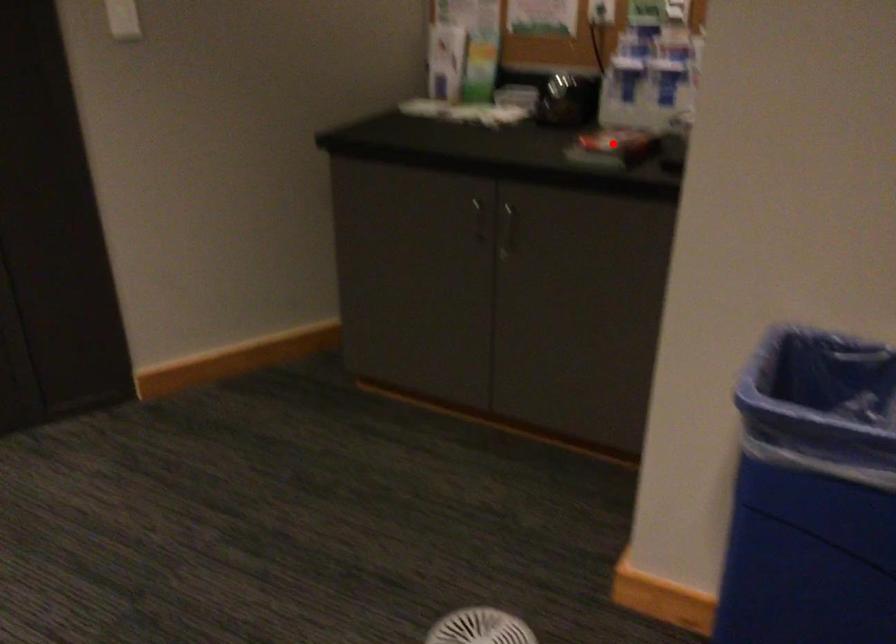
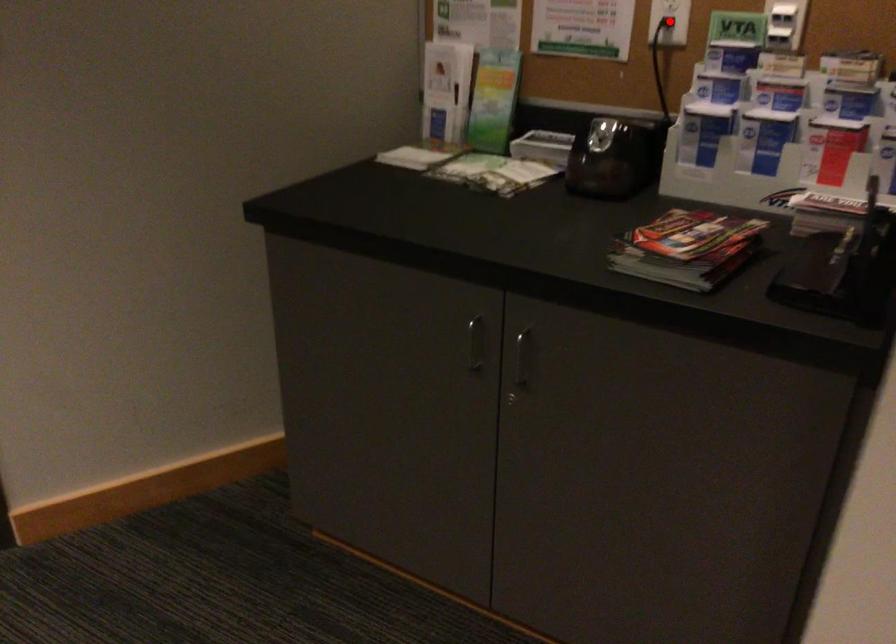
I am providing you with two images of the same scene from different viewpoints. A red point is marked on the first image and another point is marked on the second image. Are the points marked in image1 and image2 representing the same 3D position?

No